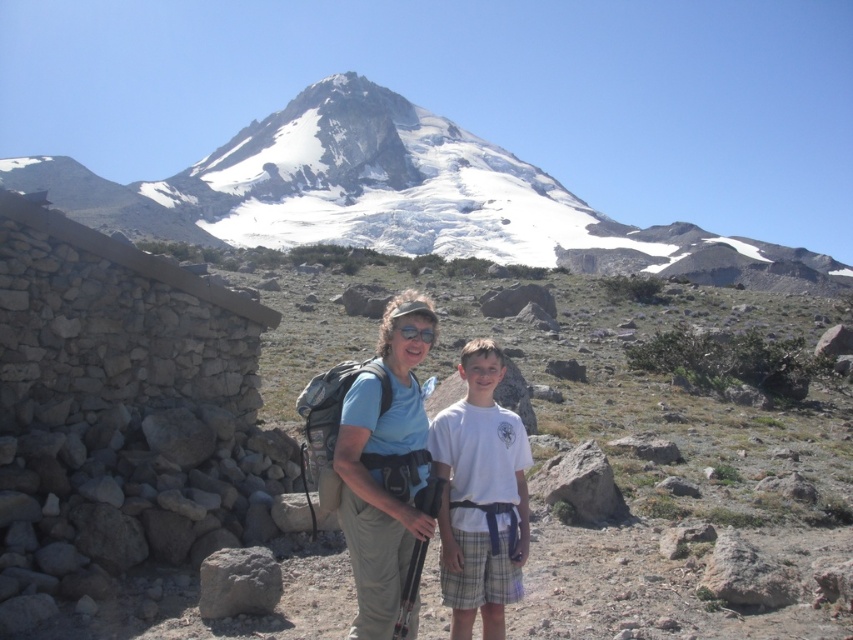
Is white snow-covered mountain at upper center bigger than gray rough rock at lower left?

Yes, white snow-covered mountain at upper center is bigger than gray rough rock at lower left.

Consider the image. Does white snow-covered mountain at upper center have a greater width compared to gray rough rock at lower left?

Yes, white snow-covered mountain at upper center is wider than gray rough rock at lower left.

Where is `white snow-covered mountain at upper center`? Image resolution: width=853 pixels, height=640 pixels. white snow-covered mountain at upper center is located at coordinates (403, 198).

Can you confirm if white snow-covered mountain at upper center is positioned to the right of white cotton shirt at center?

In fact, white snow-covered mountain at upper center is to the left of white cotton shirt at center.

Looking at this image, which of these two, white snow-covered mountain at upper center or white cotton shirt at center, stands shorter?

Standing shorter between the two is white cotton shirt at center.

Who is more distant from viewer, [256,195] or [509,483]?

The point [256,195] is more distant.

At what (x,y) coordinates should I click in order to perform the action: click on white snow-covered mountain at upper center. Please return your answer as a coordinate pair (x, y). The image size is (853, 640). Looking at the image, I should click on coord(403,198).

Is white snow-covered mountain at upper center shorter than matte blue shirt at center?

Incorrect, white snow-covered mountain at upper center's height does not fall short of matte blue shirt at center's.

Between point (344, 116) and point (396, 339), which one is positioned in front?

Point (396, 339)

Is point (636, 250) less distant than point (384, 317)?

No, it is not.

This screenshot has width=853, height=640. Identify the location of white snow-covered mountain at upper center. (403, 198).